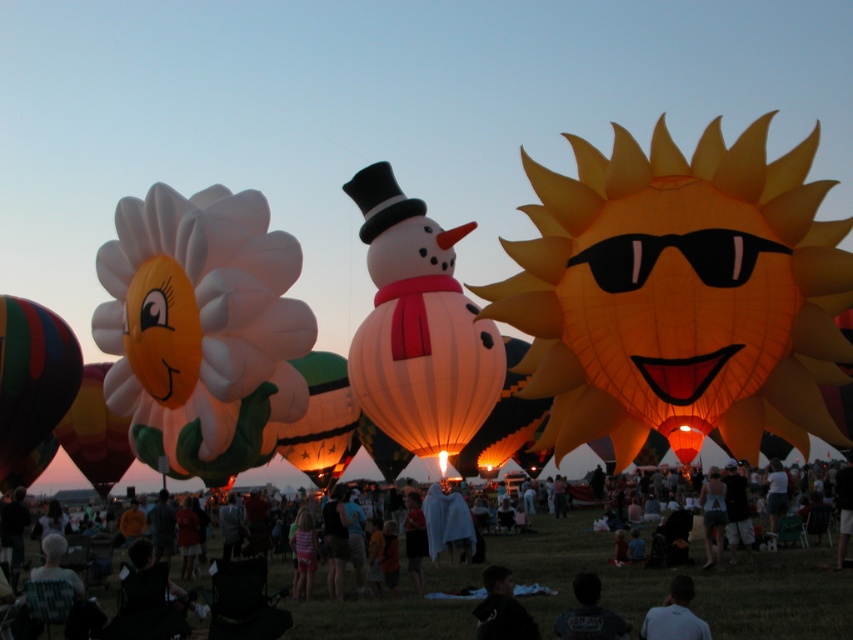
Question: Which object appears farthest from the camera in this image?

Choices:
 (A) multicolored striped hot air balloon at left
 (B) matte orange sun at center
 (C) white matte balloon at left
 (D) light blue shirt at lower right

Answer: (A)

Question: Is matte orange sun at center further to the viewer compared to matte orange snowman at center?

Choices:
 (A) yes
 (B) no

Answer: (B)

Question: Does matte black jacket at center appear on the right side of black fabric at lower center?

Choices:
 (A) yes
 (B) no

Answer: (B)

Question: Which object is closer to the camera taking this photo?

Choices:
 (A) white matte balloon at left
 (B) light blue shirt at lower right
 (C) matte black jacket at center

Answer: (B)

Question: Among these objects, which one is nearest to the camera?

Choices:
 (A) white matte balloon at left
 (B) multicolored striped hot air balloon at left

Answer: (A)

Question: Considering the relative positions of matte orange sun at center and multicolored striped hot air balloon at left in the image provided, where is matte orange sun at center located with respect to multicolored striped hot air balloon at left?

Choices:
 (A) left
 (B) right

Answer: (B)